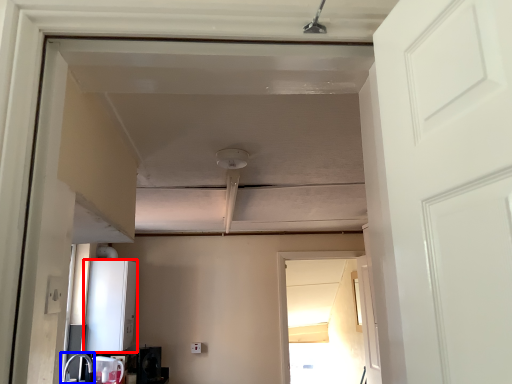
Question: Which point is further to the camera, appliance (highlighted by a red box) or sink (highlighted by a blue box)?

Choices:
 (A) appliance
 (B) sink

Answer: (A)